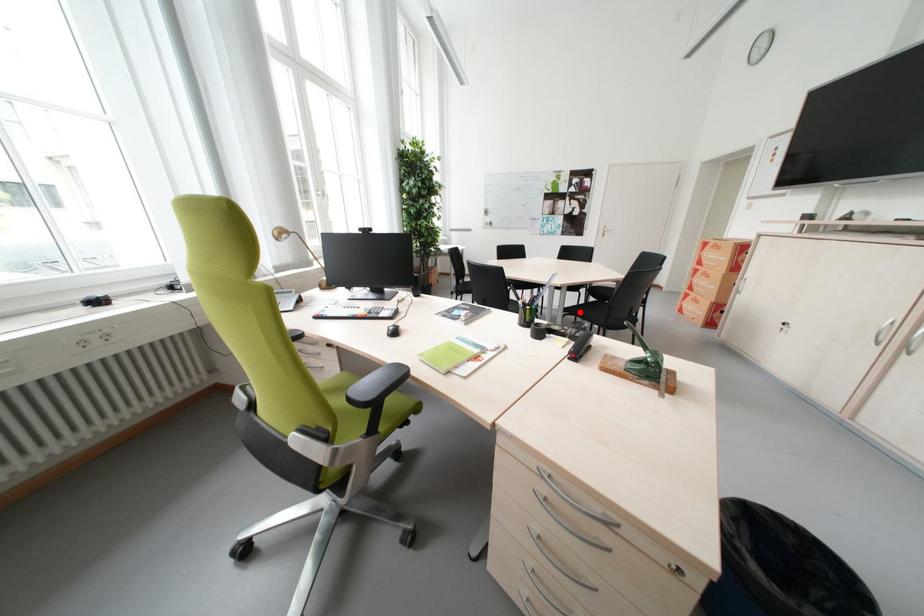
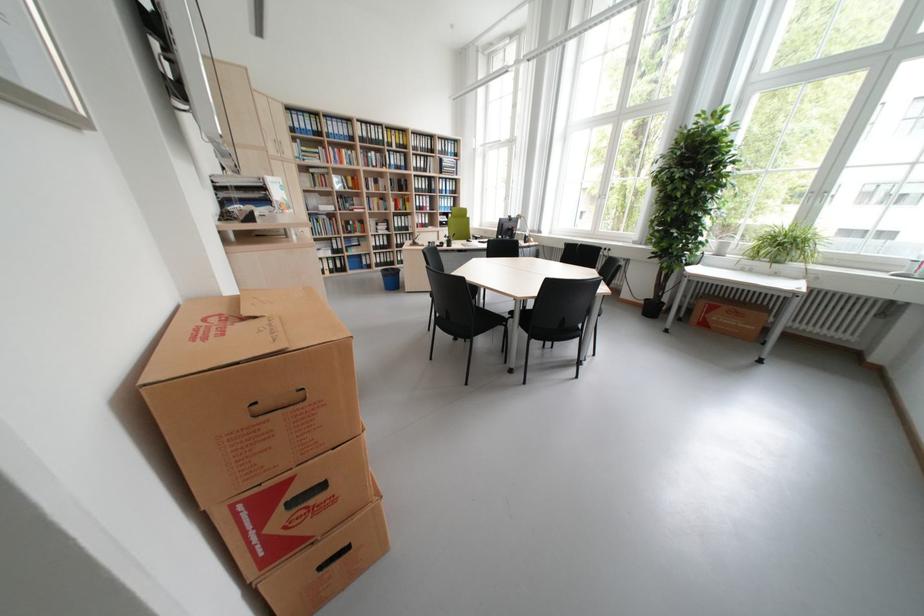
Question: I am providing you with two images of the same scene from different viewpoints. A red point is marked on the first image. Can you still see the location of the red point in image 2?

Choices:
 (A) Yes
 (B) No

Answer: (B)